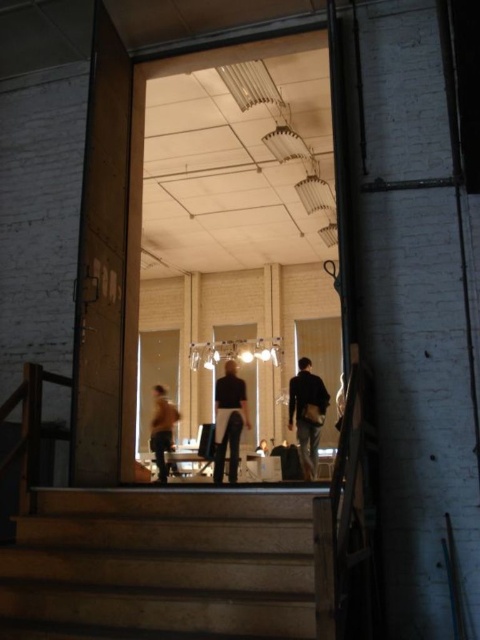
Question: Based on their relative distances, which object is farther from the orange fabric jacket at lower left?

Choices:
 (A) dark gray pants at center
 (B) brown wooden stairs at lower left
 (C) dark fabric jacket at center

Answer: (B)

Question: Does dark fabric jacket at center appear under dark gray pants at center?

Choices:
 (A) no
 (B) yes

Answer: (B)

Question: Is brown wooden stairs at lower left smaller than orange fabric jacket at lower left?

Choices:
 (A) no
 (B) yes

Answer: (B)

Question: Considering the real-world distances, which object is closest to the dark gray pants at center?

Choices:
 (A) brown wooden stairs at lower left
 (B) dark fabric jacket at center
 (C) orange fabric jacket at lower left

Answer: (B)

Question: Which point is farther to the camera?

Choices:
 (A) (165, 406)
 (B) (319, 394)
 (C) (144, 520)

Answer: (A)

Question: Can you confirm if brown wooden stairs at lower left is wider than dark gray pants at center?

Choices:
 (A) yes
 (B) no

Answer: (A)